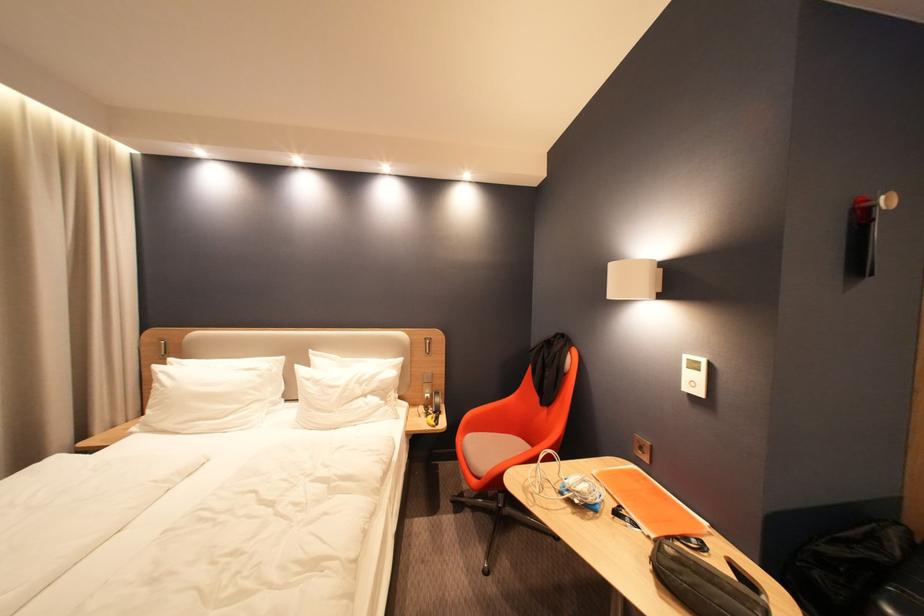
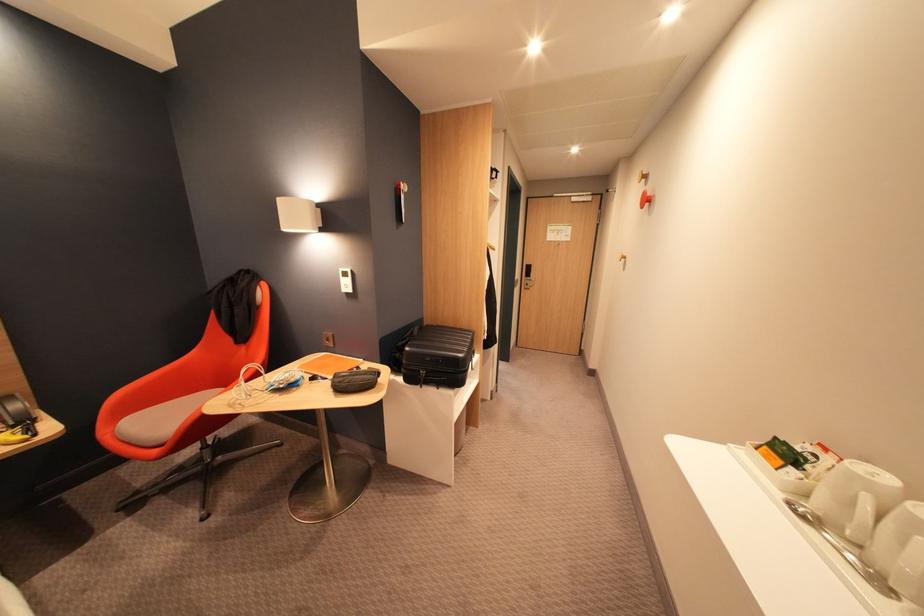
Question: The camera is either moving clockwise (left) or counter-clockwise (right) around the object. The first image is from the beginning of the video and the second image is from the end. Is the camera moving left or right when shooting the video?

Choices:
 (A) Left
 (B) Right

Answer: (A)